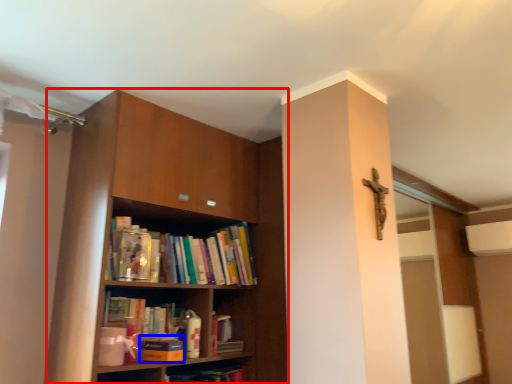
Question: Which object appears closest to the camera in this image, shelf (highlighted by a red box) or paperback book (highlighted by a blue box)?

Choices:
 (A) shelf
 (B) paperback book

Answer: (A)